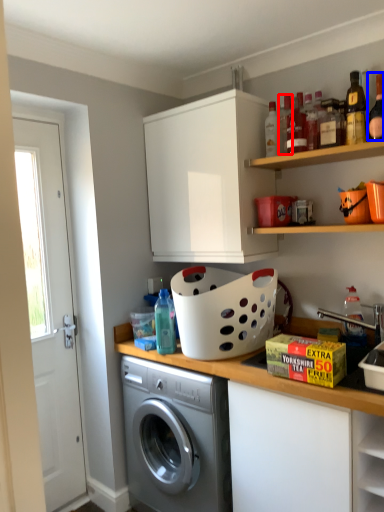
Question: Among these objects, which one is farthest to the camera, bottle (highlighted by a red box) or bottle (highlighted by a blue box)?

Choices:
 (A) bottle
 (B) bottle

Answer: (A)